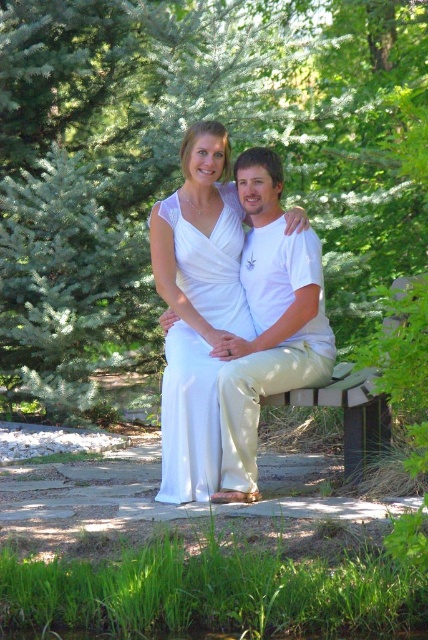
Who is taller, white cotton shirt at center or white satin dress at center?

With more height is white cotton shirt at center.

Between white cotton shirt at center and white satin dress at center, which one is positioned higher?

white cotton shirt at center is above.

Who is more distant from viewer, (267, 339) or (190, 328)?

The point (190, 328) is behind.

You are a GUI agent. You are given a task and a screenshot of the screen. Output one action in this format:
    pyautogui.click(x=<x>, y=<y>)
    Task: Click on the white cotton shirt at center
    
    Given the screenshot: What is the action you would take?
    pyautogui.click(x=269, y=323)

Between green leafy tree at upper center and wooden park bench at center, which one has less height?

Standing shorter between the two is wooden park bench at center.

Does green leafy tree at upper center appear over wooden park bench at center?

Yes.

Based on the photo, who is more forward, (249, 141) or (363, 436)?

Point (363, 436) is more forward.

At what (x,y) coordinates should I click in order to perform the action: click on green leafy tree at upper center. Please return your answer as a coordinate pair (x, y). Looking at the image, I should click on (178, 161).

Is green leafy tree at upper center smaller than white cotton shirt at center?

Actually, green leafy tree at upper center might be larger than white cotton shirt at center.

Looking at this image, who is more distant from viewer, (154,195) or (288,305)?

The point (154,195) is more distant.

I want to click on green leafy tree at upper center, so click(178, 161).